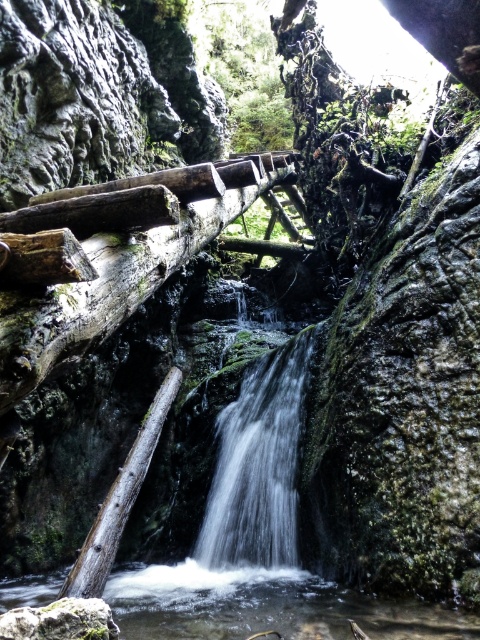
Question: Which object appears farthest from the camera in this image?

Choices:
 (A) clear water at center
 (B) white frothy water at center
 (C) green leafy tree at upper center

Answer: (C)

Question: Is clear water at center closer to camera compared to weathered wood bridge at center?

Choices:
 (A) yes
 (B) no

Answer: (B)

Question: Which object is farther from the camera taking this photo?

Choices:
 (A) weathered wood bridge at center
 (B) green leafy tree at upper center
 (C) white frothy water at center

Answer: (B)

Question: Estimate the real-world distances between objects in this image. Which object is closer to the green leafy tree at upper center?

Choices:
 (A) white frothy water at center
 (B) clear water at center
 (C) weathered wood bridge at center

Answer: (A)

Question: Can you confirm if clear water at center is smaller than white frothy water at center?

Choices:
 (A) no
 (B) yes

Answer: (A)

Question: Does weathered wood bridge at center have a greater width compared to green leafy tree at upper center?

Choices:
 (A) yes
 (B) no

Answer: (B)